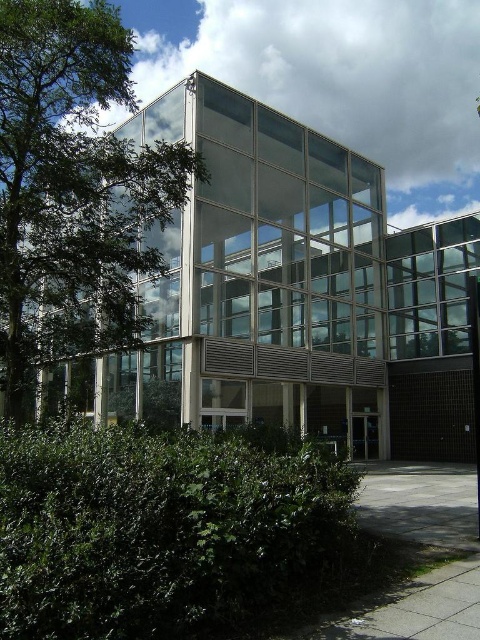
You are standing in front of the modern building and notice two green plants. Which one is positioned more to the left side, the green leafy bush at lower left or the green leafy tree at left?

The green leafy tree at left is positioned more to the left side because the green leafy bush at lower left is to the right of it.

Looking at this image, you are a landscape architect designing a pathway between the green leafy bush at lower left and the green leafy tree at left. Based on their positions, which object should the pathway start closer to the building and extend towards?

The pathway should start closer to the building near the green leafy bush at lower left and extend towards the green leafy tree at left since the bush is positioned under the tree.